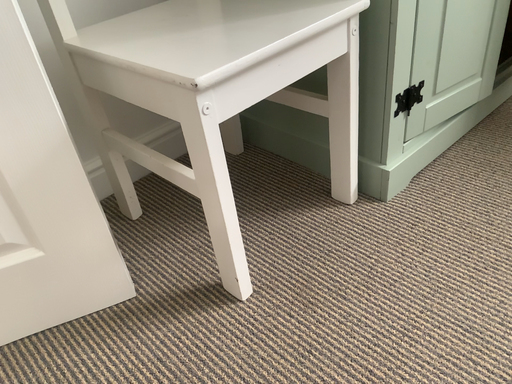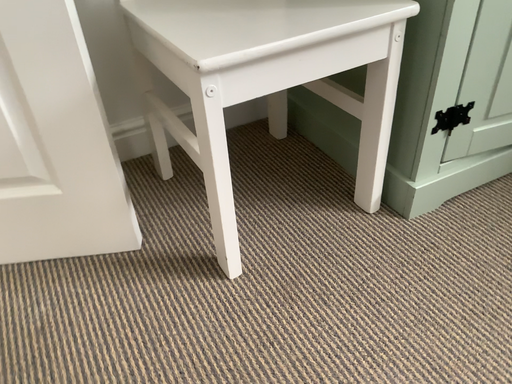
Question: Which way did the camera rotate in the video?

Choices:
 (A) rotated left
 (B) rotated right

Answer: (A)